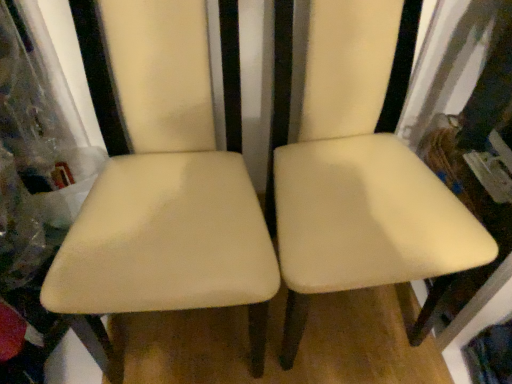
Find the location of a particular element. beige leather chair at center, the 1th chair in the left-to-right sequence is located at coordinates (165, 187).

Image resolution: width=512 pixels, height=384 pixels. What do you see at coordinates (165, 187) in the screenshot?
I see `beige leather chair at center, the 1th chair in the left-to-right sequence` at bounding box center [165, 187].

Describe the element at coordinates (360, 174) in the screenshot. I see `matte cream chair at center, the 2th chair when ordered from left to right` at that location.

Looking at this image, how much space does matte cream chair at center, which appears as the first chair when viewed from the right, occupy horizontally?

It is 58.05 centimeters.

Measure the distance between matte cream chair at center, the 2th chair when ordered from left to right, and camera.

The depth of matte cream chair at center, the 2th chair when ordered from left to right, is 79.42 centimeters.

How much space does matte cream chair at center, which appears as the first chair when viewed from the right, occupy vertically?

1.04 meters.

Locate an element on the screen. The width and height of the screenshot is (512, 384). matte cream chair at center, the 2th chair when ordered from left to right is located at coordinates (360, 174).

Image resolution: width=512 pixels, height=384 pixels. Find the location of `beige leather chair at center, positioned as the 2th chair in right-to-left order`. beige leather chair at center, positioned as the 2th chair in right-to-left order is located at coordinates (165, 187).

Which is more to the right, matte cream chair at center, the 2th chair when ordered from left to right, or beige leather chair at center, positioned as the 2th chair in right-to-left order?

From the viewer's perspective, matte cream chair at center, the 2th chair when ordered from left to right, appears more on the right side.

Looking at this image, which is in front, matte cream chair at center, which appears as the first chair when viewed from the right, or beige leather chair at center, the 1th chair in the left-to-right sequence?

beige leather chair at center, the 1th chair in the left-to-right sequence, is closer to the camera.

Does point (290, 350) appear closer or farther from the camera than point (197, 246)?

Point (290, 350) appears to be farther away from the viewer than point (197, 246).

From the image's perspective, between matte cream chair at center, which appears as the first chair when viewed from the right, and beige leather chair at center, positioned as the 2th chair in right-to-left order, who is located below?

beige leather chair at center, positioned as the 2th chair in right-to-left order, is shown below in the image.

From a real-world perspective, is matte cream chair at center, which appears as the first chair when viewed from the right, under beige leather chair at center, positioned as the 2th chair in right-to-left order?

Correct, in the physical world, matte cream chair at center, which appears as the first chair when viewed from the right, is lower than beige leather chair at center, positioned as the 2th chair in right-to-left order.

Which of these two, matte cream chair at center, which appears as the first chair when viewed from the right, or beige leather chair at center, positioned as the 2th chair in right-to-left order, is wider?

matte cream chair at center, which appears as the first chair when viewed from the right.

Which of these two, matte cream chair at center, which appears as the first chair when viewed from the right, or beige leather chair at center, the 1th chair in the left-to-right sequence, stands taller?

matte cream chair at center, which appears as the first chair when viewed from the right.

Based on their sizes in the image, would you say matte cream chair at center, the 2th chair when ordered from left to right, is bigger or smaller than beige leather chair at center, positioned as the 2th chair in right-to-left order?

In the image, matte cream chair at center, the 2th chair when ordered from left to right, appears to be larger than beige leather chair at center, positioned as the 2th chair in right-to-left order.

Would you say matte cream chair at center, the 2th chair when ordered from left to right, contains beige leather chair at center, the 1th chair in the left-to-right sequence?

No, beige leather chair at center, the 1th chair in the left-to-right sequence, is not inside matte cream chair at center, the 2th chair when ordered from left to right.

Is matte cream chair at center, which appears as the first chair when viewed from the right, placed right next to beige leather chair at center, positioned as the 2th chair in right-to-left order?

matte cream chair at center, which appears as the first chair when viewed from the right, and beige leather chair at center, positioned as the 2th chair in right-to-left order, are clearly separated.

Could you tell me if matte cream chair at center, which appears as the first chair when viewed from the right, is turned towards beige leather chair at center, positioned as the 2th chair in right-to-left order?

No, matte cream chair at center, which appears as the first chair when viewed from the right, is not facing towards beige leather chair at center, positioned as the 2th chair in right-to-left order.

What's the angular difference between matte cream chair at center, the 2th chair when ordered from left to right, and beige leather chair at center, positioned as the 2th chair in right-to-left order,'s facing directions?

The angle between the facing direction of matte cream chair at center, the 2th chair when ordered from left to right, and the facing direction of beige leather chair at center, positioned as the 2th chair in right-to-left order, is 3.35 degrees.

How distant is matte cream chair at center, the 2th chair when ordered from left to right, from beige leather chair at center, positioned as the 2th chair in right-to-left order?

matte cream chair at center, the 2th chair when ordered from left to right, is 9.84 inches away from beige leather chair at center, positioned as the 2th chair in right-to-left order.

Where is `chair behind the beige leather chair at center, the 1th chair in the left-to-right sequence`? chair behind the beige leather chair at center, the 1th chair in the left-to-right sequence is located at coordinates (360, 174).

Which object is positioned more to the left, beige leather chair at center, positioned as the 2th chair in right-to-left order, or matte cream chair at center, which appears as the first chair when viewed from the right?

From the viewer's perspective, beige leather chair at center, positioned as the 2th chair in right-to-left order, appears more on the left side.

Looking at this image, in the image, is beige leather chair at center, the 1th chair in the left-to-right sequence, positioned in front of or behind matte cream chair at center, which appears as the first chair when viewed from the right?

beige leather chair at center, the 1th chair in the left-to-right sequence, is positioned closer to the viewer than matte cream chair at center, which appears as the first chair when viewed from the right.

Is point (117, 234) positioned in front of point (368, 8)?

Yes, it is in front of point (368, 8).

Based on the photo, from the image's perspective, is beige leather chair at center, positioned as the 2th chair in right-to-left order, beneath matte cream chair at center, which appears as the first chair when viewed from the right?

Correct, beige leather chair at center, positioned as the 2th chair in right-to-left order, appears lower than matte cream chair at center, which appears as the first chair when viewed from the right, in the image.

From a real-world perspective, is beige leather chair at center, the 1th chair in the left-to-right sequence, physically located above or below matte cream chair at center, which appears as the first chair when viewed from the right?

beige leather chair at center, the 1th chair in the left-to-right sequence, is above matte cream chair at center, which appears as the first chair when viewed from the right.

From the picture: Which of these two, beige leather chair at center, the 1th chair in the left-to-right sequence, or matte cream chair at center, the 2th chair when ordered from left to right, is wider?

matte cream chair at center, the 2th chair when ordered from left to right.

Can you confirm if beige leather chair at center, positioned as the 2th chair in right-to-left order, is shorter than matte cream chair at center, which appears as the first chair when viewed from the right?

Indeed, beige leather chair at center, positioned as the 2th chair in right-to-left order, has a lesser height compared to matte cream chair at center, which appears as the first chair when viewed from the right.

Does beige leather chair at center, positioned as the 2th chair in right-to-left order, have a smaller size compared to matte cream chair at center, which appears as the first chair when viewed from the right?

Yes.

Is beige leather chair at center, the 1th chair in the left-to-right sequence, surrounding matte cream chair at center, which appears as the first chair when viewed from the right?

No, matte cream chair at center, which appears as the first chair when viewed from the right, is located outside of beige leather chair at center, the 1th chair in the left-to-right sequence.

Is beige leather chair at center, positioned as the 2th chair in right-to-left order, positioned far away from matte cream chair at center, which appears as the first chair when viewed from the right?

No, beige leather chair at center, positioned as the 2th chair in right-to-left order, is in close proximity to matte cream chair at center, which appears as the first chair when viewed from the right.

Could you tell me if beige leather chair at center, the 1th chair in the left-to-right sequence, is turned towards matte cream chair at center, which appears as the first chair when viewed from the right?

No, beige leather chair at center, the 1th chair in the left-to-right sequence, is not aimed at matte cream chair at center, which appears as the first chair when viewed from the right.

How different are the orientations of beige leather chair at center, positioned as the 2th chair in right-to-left order, and matte cream chair at center, which appears as the first chair when viewed from the right, in degrees?

3.35 degrees.

Identify the location of chair located in front of the matte cream chair at center, the 2th chair when ordered from left to right. (165, 187).

Where is `chair behind the beige leather chair at center, the 1th chair in the left-to-right sequence`? The height and width of the screenshot is (384, 512). chair behind the beige leather chair at center, the 1th chair in the left-to-right sequence is located at coordinates (360, 174).

Identify the location of chair located below the matte cream chair at center, the 2th chair when ordered from left to right (from the image's perspective). (165, 187).